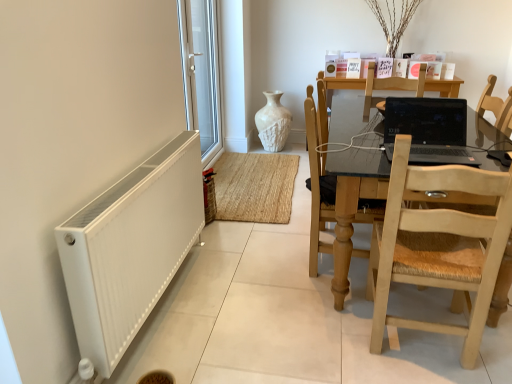
Identify the location of vacant area that lies between light wood/rattan chair at right, the first chair viewed from the front, and white matte radiator at lower left. Image resolution: width=512 pixels, height=384 pixels. (280, 321).